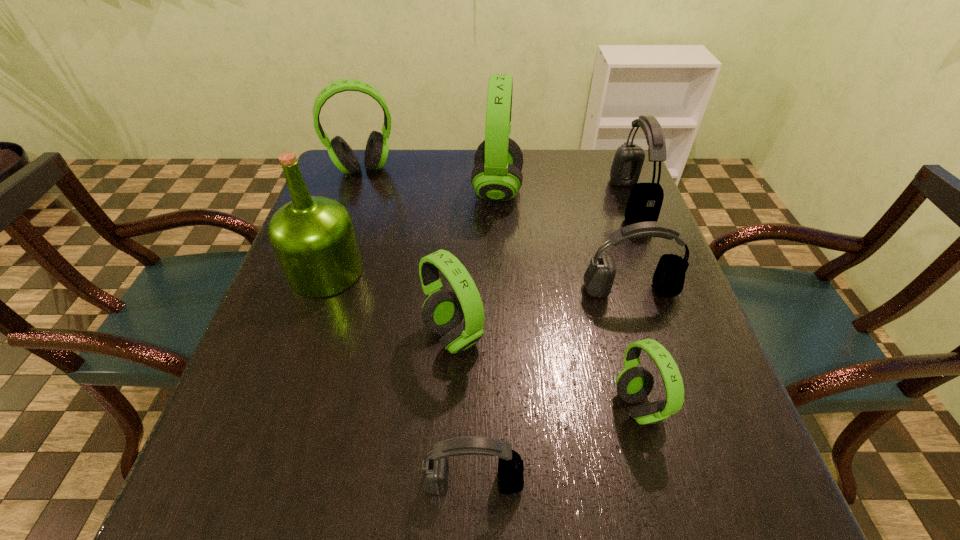
At what (x,y) coordinates should I click in order to perform the action: click on empty space between the third biggest green headset and the leftmost green headset. Please return your answer as a coordinate pair (x, y). Image resolution: width=960 pixels, height=540 pixels. Looking at the image, I should click on (408, 253).

You are a GUI agent. You are given a task and a screenshot of the screen. Output one action in this format:
    pyautogui.click(x=<x>, y=<y>)
    Task: Click on the object that is the third closest to the leftmost green headset
    This screenshot has height=540, width=960.
    Given the screenshot: What is the action you would take?
    pyautogui.click(x=443, y=311)

Where is `object that stands as the third closest to the leftmost headset`? This screenshot has width=960, height=540. object that stands as the third closest to the leftmost headset is located at coordinates (443, 311).

Image resolution: width=960 pixels, height=540 pixels. I want to click on the second closest headset to the tallest headset, so click(x=645, y=200).

Select which headset is the second closest to the seventh farthest object. Please provide its 2D coordinates. Your answer should be formatted as a tuple, i.e. [(x, y)], where the tuple contains the x and y coordinates of a point satisfying the conditions above.

[(668, 280)]

Locate which green headset ranks fourth in proximity to the farthest black headset. Please provide its 2D coordinates. Your answer should be formatted as a tuple, i.e. [(x, y)], where the tuple contains the x and y coordinates of a point satisfying the conditions above.

[(377, 148)]

Find the location of a particular element. This screenshot has height=540, width=960. green headset identified as the closest to the nearest black headset is located at coordinates (634, 384).

Locate which black headset ranks second in proximity to the leftmost black headset. Please provide its 2D coordinates. Your answer should be formatted as a tuple, i.e. [(x, y)], where the tuple contains the x and y coordinates of a point satisfying the conditions above.

[(645, 200)]

This screenshot has width=960, height=540. In order to click on black headset identified as the second closest to the third smallest green headset in this screenshot , I will do `click(645, 200)`.

You are a GUI agent. You are given a task and a screenshot of the screen. Output one action in this format:
    pyautogui.click(x=<x>, y=<y>)
    Task: Click on the vacant area that satisfies the following two spatial constraints: 1. on the front side of the green olive oil; 2. on the left side of the rightmost green headset
    
    Given the screenshot: What is the action you would take?
    pyautogui.click(x=280, y=406)